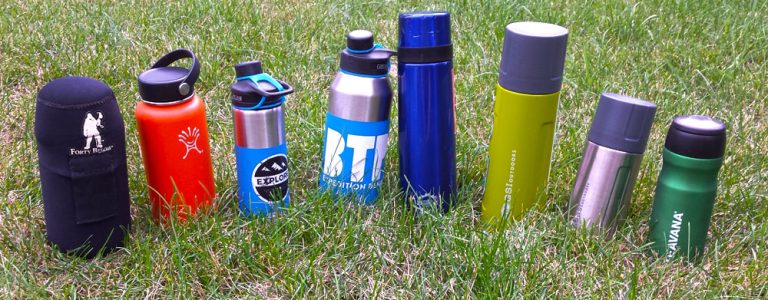
Locate an element on the screen. thermos is located at coordinates (81, 175), (180, 148), (260, 144), (382, 120), (419, 121), (538, 130), (608, 183), (697, 214).